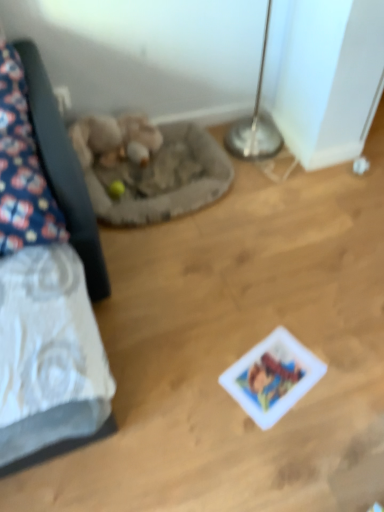
You are a GUI agent. You are given a task and a screenshot of the screen. Output one action in this format:
    pyautogui.click(x=<x>, y=<y>)
    Task: Click on the vacant space in front of gray fabric cat bed at center-left
    
    Given the screenshot: What is the action you would take?
    pyautogui.click(x=189, y=270)